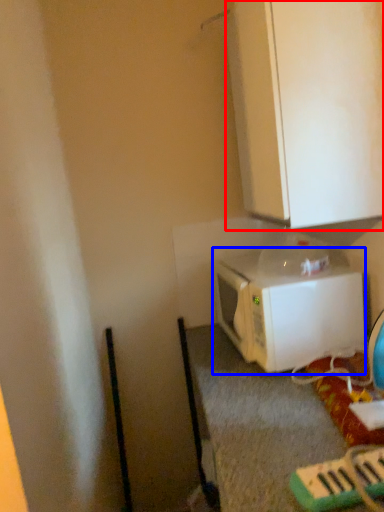
Question: Which point is closer to the camera, cabinetry (highlighted by a red box) or microwave oven (highlighted by a blue box)?

Choices:
 (A) cabinetry
 (B) microwave oven

Answer: (A)